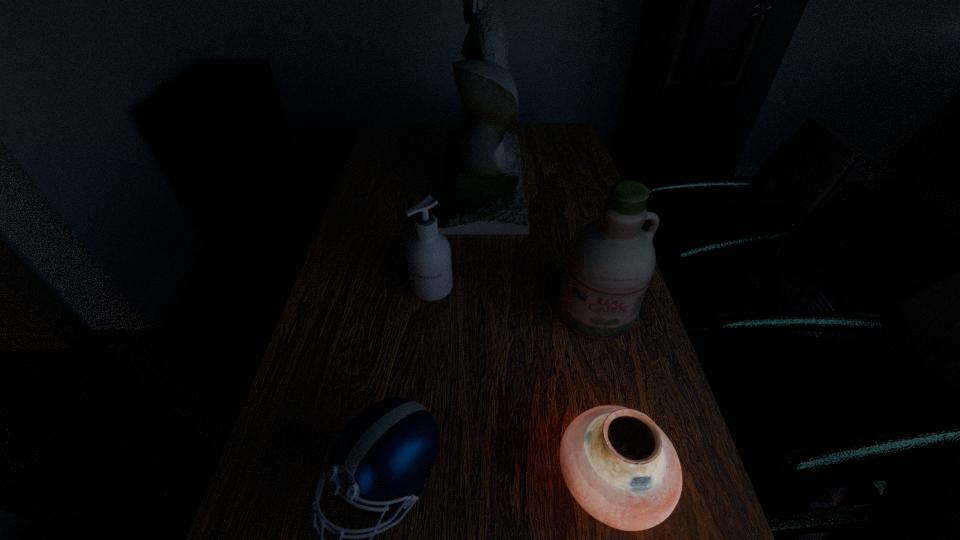
Where is `vacant space situated 0.270m on the front label of the left cleansing agent`? The image size is (960, 540). vacant space situated 0.270m on the front label of the left cleansing agent is located at coordinates (420, 400).

The height and width of the screenshot is (540, 960). In order to click on object that is at the far edge in this screenshot , I will do `click(482, 193)`.

Locate an element on the screen. object that is at the right edge is located at coordinates (610, 261).

The width and height of the screenshot is (960, 540). Identify the location of free region at the far edge of the desktop. (535, 151).

Identify the location of vacant space at the left edge of the desktop. (381, 160).

This screenshot has height=540, width=960. I want to click on vacant region at the right edge of the desktop, so click(x=637, y=318).

The width and height of the screenshot is (960, 540). I want to click on vacant position at the far left corner of the desktop, so (x=382, y=140).

Where is `vacant region at the far right corner`? This screenshot has height=540, width=960. vacant region at the far right corner is located at coordinates (566, 123).

This screenshot has width=960, height=540. In order to click on unoccupied position between the taller cleansing agent and the sculpture in this screenshot , I will do `click(539, 246)`.

Where is `vacant space in between the left cleansing agent and the tallest object`? vacant space in between the left cleansing agent and the tallest object is located at coordinates (458, 234).